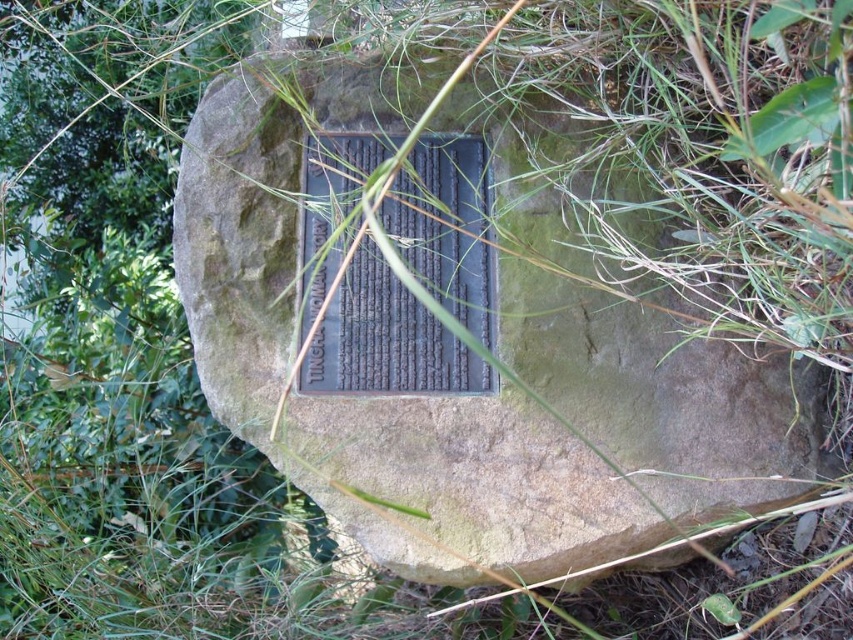
You are a maintenance worker who needs to clean both the bronze plaque at center and the black polished stone plaque at center. The cleaning tool you have can only reach 3 inches. Can you clean both plaques without moving the tool?

The bronze plaque at center is 3.84 inches away from the black polished stone plaque at center. Since the distance between them is greater than the tool can reach, you cannot clean both plaques without moving the tool.

You are a tour guide explaining the plaques on the rock. You need to point out the bronze plaque at center to your visitors. Which direction should you point relative to the black polished stone plaque at center?

The bronze plaque at center is to the right of the black polished stone plaque at center, so you should point to the right side of the black polished stone plaque at center.

You are a tour guide explaining the plaques on the rock. You need to inform visitors about the size difference between the bronze plaque at center and the black polished stone plaque at center. What should you mention?

The bronze plaque at center is taller than the black polished stone plaque at center.